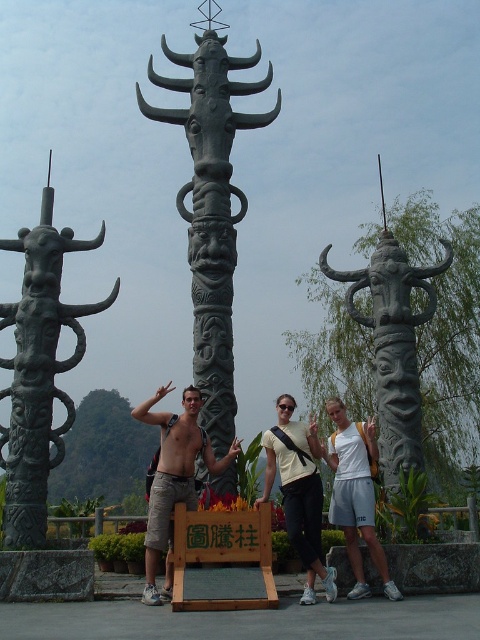
Which is behind, point (206, 417) or point (192, 410)?

The point (206, 417) is behind.

Is black stone totem at center smaller than shiny silver statue at center?

Incorrect, black stone totem at center is not smaller in size than shiny silver statue at center.

Is point (228, 324) more distant than point (167, 472)?

Yes.

I want to click on black stone totem at center, so click(212, 211).

Does point (235, 484) come in front of point (384, 378)?

That is True.

Is point (205, 252) less distant than point (395, 388)?

No.

I want to click on black stone totem at center, so 212,211.

Which is behind, point (294, 497) or point (360, 506)?

Point (294, 497)

Can you confirm if white matte shirt at center is positioned above matte black shorts at center?

Yes, white matte shirt at center is above matte black shorts at center.

The height and width of the screenshot is (640, 480). What do you see at coordinates (299, 492) in the screenshot?
I see `white matte shirt at center` at bounding box center [299, 492].

Identify the location of white matte shirt at center. The image size is (480, 640). (299, 492).